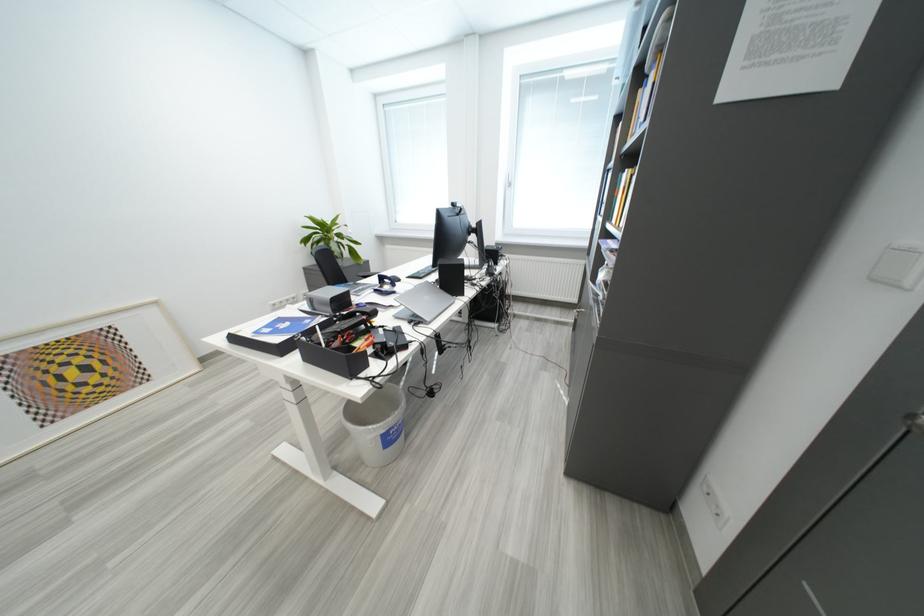
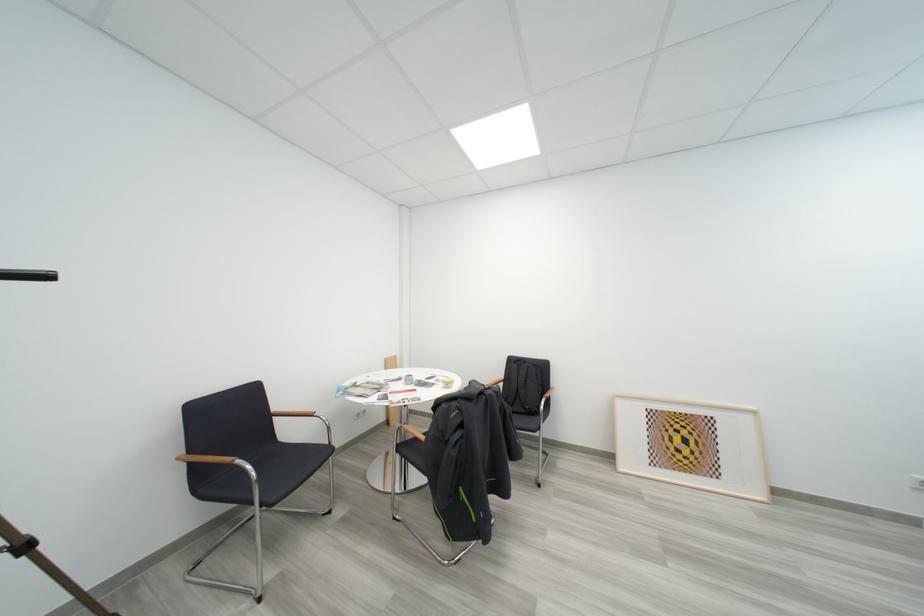
Question: The camera is either moving clockwise (left) or counter-clockwise (right) around the object. The first image is from the beginning of the video and the second image is from the end. Is the camera moving left or right when shooting the video?

Choices:
 (A) Left
 (B) Right

Answer: (B)